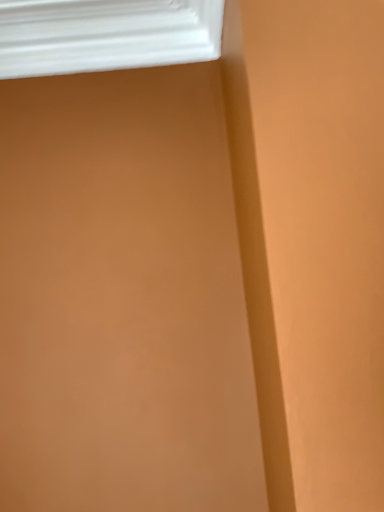
What do you see at coordinates (105, 34) in the screenshot? I see `white plastic window at upper left` at bounding box center [105, 34].

The image size is (384, 512). What are the coordinates of `white plastic window at upper left` in the screenshot? It's located at (105, 34).

In the scene shown: In order to face white plastic window at upper left, should I rotate leftwards or rightwards?

Rotate your view left by about 11.906°.

This screenshot has height=512, width=384. What are the coordinates of `white plastic window at upper left` in the screenshot? It's located at (105, 34).